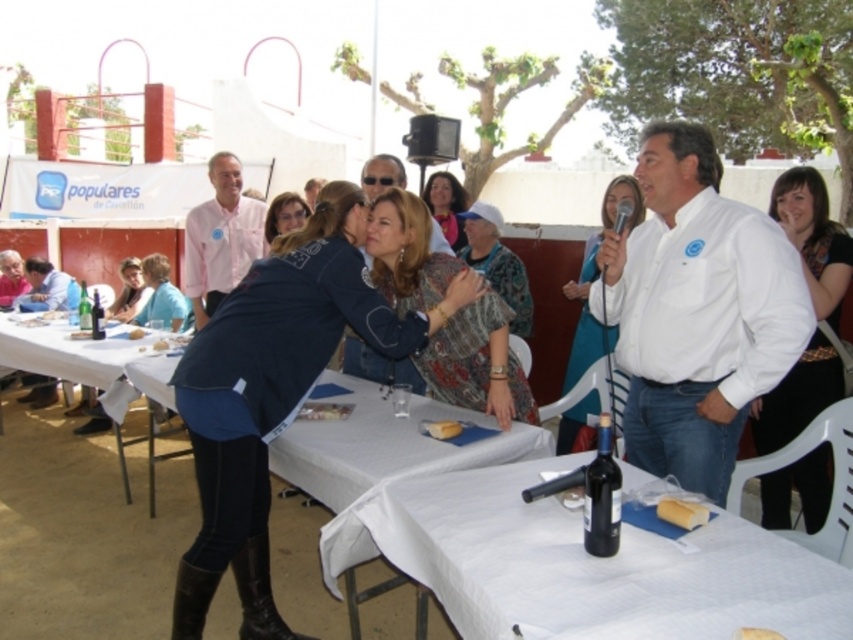
Question: Which point appears farthest from the camera in this image?

Choices:
 (A) (288, 195)
 (B) (645, 374)

Answer: (A)

Question: Can you confirm if white bread at lower center is thinner than white bread at center?

Choices:
 (A) no
 (B) yes

Answer: (B)

Question: Is pink shirt at center closer to camera compared to golden bread at center?

Choices:
 (A) no
 (B) yes

Answer: (A)

Question: Based on their relative distances, which object is farther from the white cloth at lower center?

Choices:
 (A) light brown leather jacket at upper left
 (B) white cotton shirt at center
 (C) patterned fabric dress at center

Answer: (A)

Question: Which point is closer to the camera?

Choices:
 (A) matte blue jacket at center
 (B) light brown leather jacket at upper left
 (C) dark blue leather jacket at center
 (D) white cotton shirt at center

Answer: (C)

Question: Does white cotton shirt at center have a lesser width compared to black jersey at upper right?

Choices:
 (A) no
 (B) yes

Answer: (B)